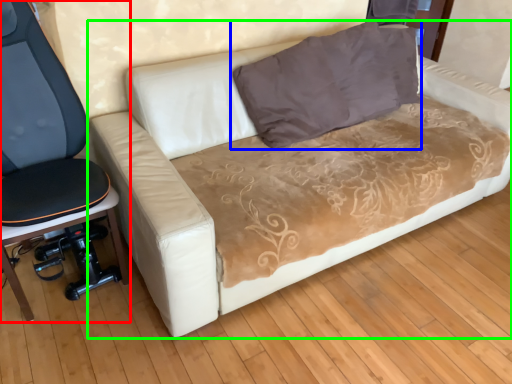
Question: Based on their relative distances, which object is nearer to furniture (highlighted by a red box)? Choose from pillow (highlighted by a blue box) and studio couch (highlighted by a green box).

Choices:
 (A) pillow
 (B) studio couch

Answer: (B)